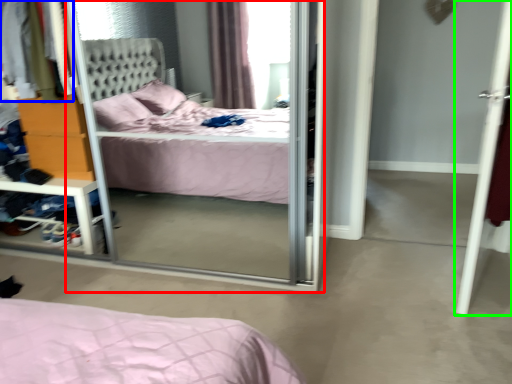
Question: Based on their relative distances, which object is farther from screen door (highlighted by a red box)? Choose from clothing (highlighted by a blue box) and door (highlighted by a green box).

Choices:
 (A) clothing
 (B) door

Answer: (B)